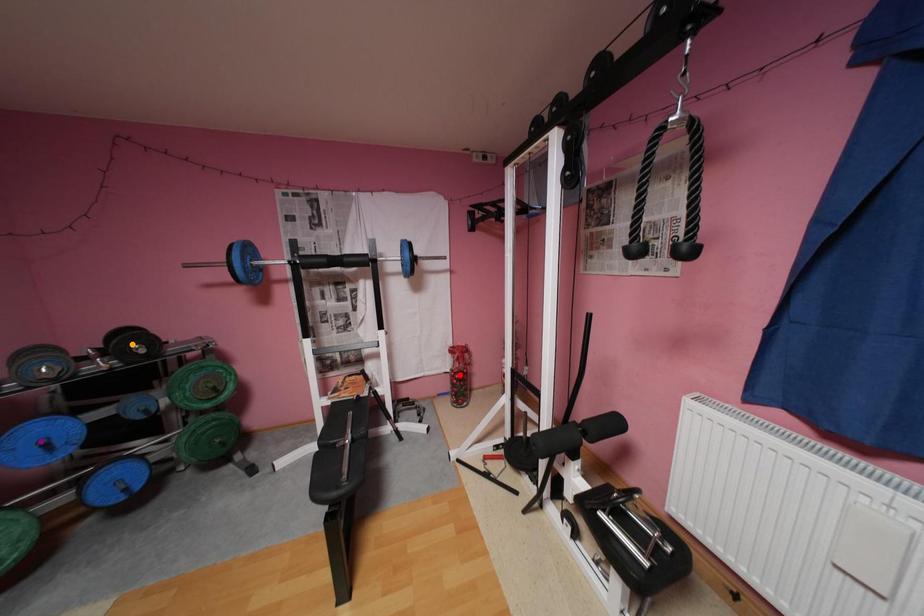
Order these from nearest to farthest:
- orange point
- red point
- purple point

red point, orange point, purple point